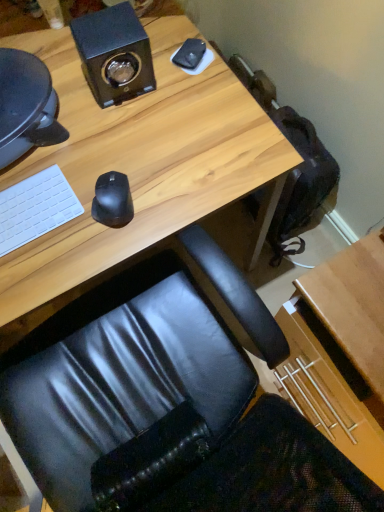
The height and width of the screenshot is (512, 384). In order to click on vacant area on the back side of black matte mouse at center in this screenshot , I will do `click(118, 142)`.